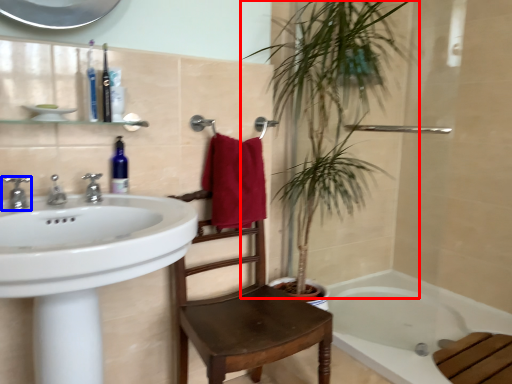
Question: Which of the following is the farthest to the observer, vegetation (highlighted by a red box) or tap (highlighted by a blue box)?

Choices:
 (A) vegetation
 (B) tap

Answer: (A)